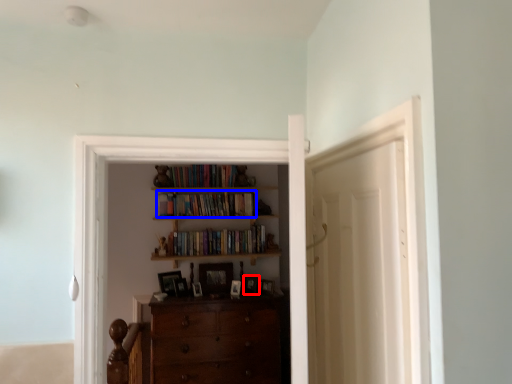
Question: Which of the following is the farthest to the observer, picture frame (highlighted by a red box) or book (highlighted by a blue box)?

Choices:
 (A) picture frame
 (B) book

Answer: (B)